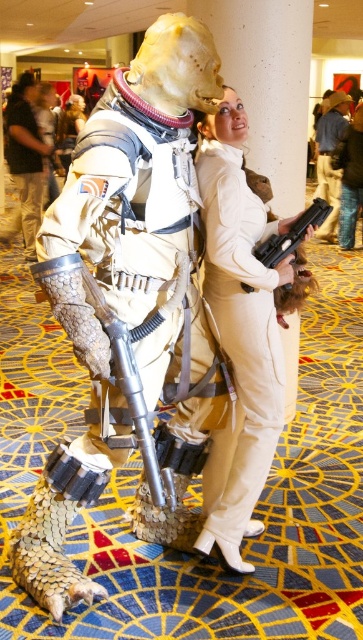
Identify the location of matte white suit at center. The width and height of the screenshot is (363, 640). (238, 332).

Is point (263, 472) farther from viewer compared to point (26, 243)?

That is False.

Is point (222, 444) farther from camera compared to point (29, 198)?

No.

The height and width of the screenshot is (640, 363). Find the location of `matte white suit at center`. matte white suit at center is located at coordinates (238, 332).

Does matte white suit at center have a lesser width compared to black plastic gun at center?

No, matte white suit at center is not thinner than black plastic gun at center.

Is the position of matte white suit at center more distant than that of black plastic gun at center?

Yes, it is.

Locate an element on the screen. The width and height of the screenshot is (363, 640). matte white suit at center is located at coordinates click(x=238, y=332).

Which is more to the left, metallic armor at center or metallic silver armor at left?

From the viewer's perspective, metallic silver armor at left appears more on the left side.

Between metallic armor at center and metallic silver armor at left, which one has more height?

Standing taller between the two is metallic silver armor at left.

Who is more forward, (174,314) or (23,132)?

Point (174,314)

The image size is (363, 640). In order to click on metallic armor at center in this screenshot , I will do `click(128, 241)`.